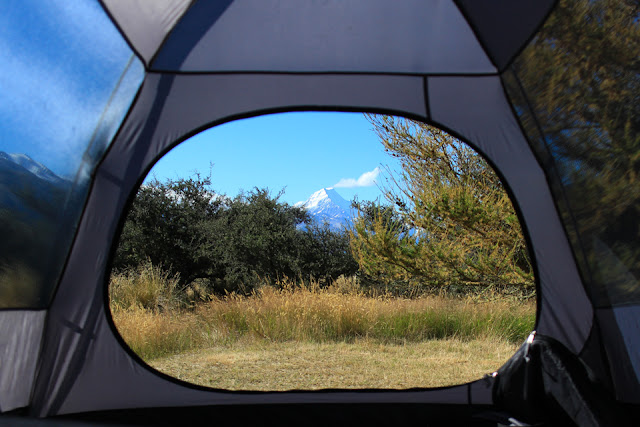
The image size is (640, 427). What are the coordinates of `space above window` in the screenshot? It's located at (310, 86).